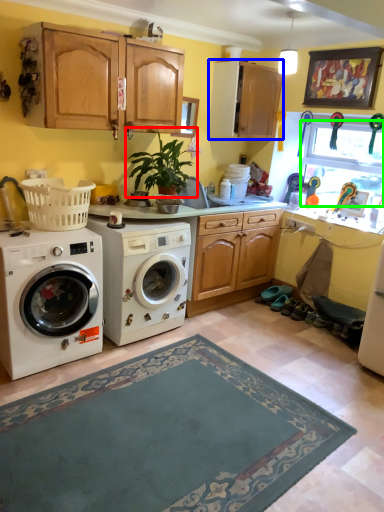
Question: Which object is the farthest from plant (highlighted by a red box)? Choose among these: cabinetry (highlighted by a blue box) or window screen (highlighted by a green box).

Choices:
 (A) cabinetry
 (B) window screen

Answer: (B)